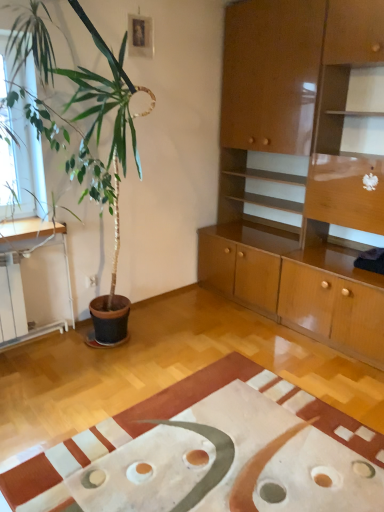
Locate an element on the screen. This screenshot has width=384, height=512. free space above white matte rug at lower center (from a real-world perspective) is located at coordinates (211, 442).